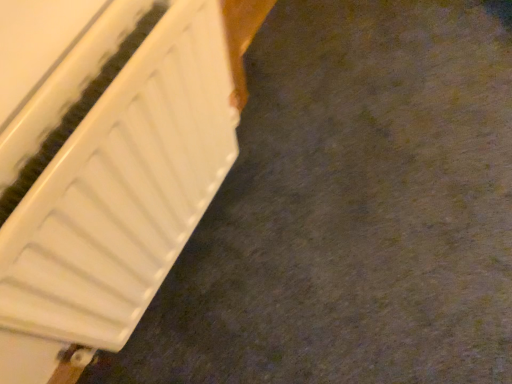
Question: Should I look upward or downward to see white matte radiator at left?

Choices:
 (A) down
 (B) up

Answer: (A)